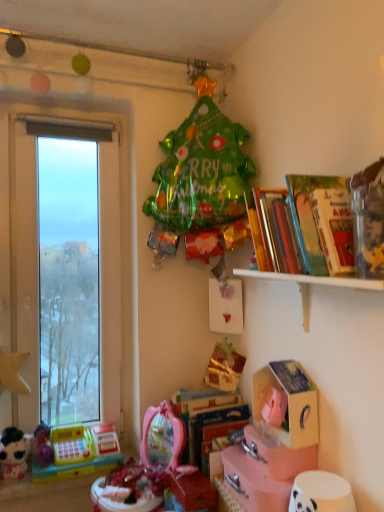
Question: Is yellow plastic cash register at lower left, which appears as the 2th toy when viewed from the left, outside of plush white cat at lower left, acting as the first toy starting from the left?

Choices:
 (A) yes
 (B) no

Answer: (A)

Question: Is yellow plastic cash register at lower left, the 3th toy viewed from the right, turned away from plush white cat at lower left, acting as the 4th toy starting from the right?

Choices:
 (A) no
 (B) yes

Answer: (A)

Question: Is yellow plastic cash register at lower left, the 3th toy viewed from the right, thinner than plush white cat at lower left, acting as the first toy starting from the left?

Choices:
 (A) yes
 (B) no

Answer: (B)

Question: Can you confirm if yellow plastic cash register at lower left, which appears as the 2th toy when viewed from the left, is positioned to the left of plush white cat at lower left, acting as the first toy starting from the left?

Choices:
 (A) no
 (B) yes

Answer: (A)

Question: Is yellow plastic cash register at lower left, the 3th toy viewed from the right, surrounding plush white cat at lower left, acting as the 4th toy starting from the right?

Choices:
 (A) no
 (B) yes

Answer: (A)

Question: Is yellow plastic cash register at lower left, the 3th toy viewed from the right, at the right side of plush white cat at lower left, acting as the 4th toy starting from the right?

Choices:
 (A) no
 (B) yes

Answer: (B)

Question: Is transparent glass window at left positioned before matte pink cardboard box at lower center, which is the 2th cardboard box in bottom-to-top order?

Choices:
 (A) no
 (B) yes

Answer: (A)

Question: Is transparent glass window at left not close to matte pink cardboard box at lower center, which appears as the first cardboard box when viewed from the top?

Choices:
 (A) no
 (B) yes

Answer: (A)

Question: Is transparent glass window at left thinner than matte pink cardboard box at lower center, which appears as the first cardboard box when viewed from the top?

Choices:
 (A) no
 (B) yes

Answer: (B)

Question: Is transparent glass window at left facing towards matte pink cardboard box at lower center, which is the 2th cardboard box in bottom-to-top order?

Choices:
 (A) yes
 (B) no

Answer: (B)

Question: Is transparent glass window at left smaller than matte pink cardboard box at lower center, which appears as the first cardboard box when viewed from the top?

Choices:
 (A) no
 (B) yes

Answer: (A)

Question: Is the surface of transparent glass window at left in direct contact with matte pink cardboard box at lower center, which is the 2th cardboard box in bottom-to-top order?

Choices:
 (A) no
 (B) yes

Answer: (A)

Question: Are shiny pink toy at center, which appears as the 2th toy when viewed from the right, and hardcover book at center, placed as the first book when sorted from bottom to top, located far from each other?

Choices:
 (A) no
 (B) yes

Answer: (A)